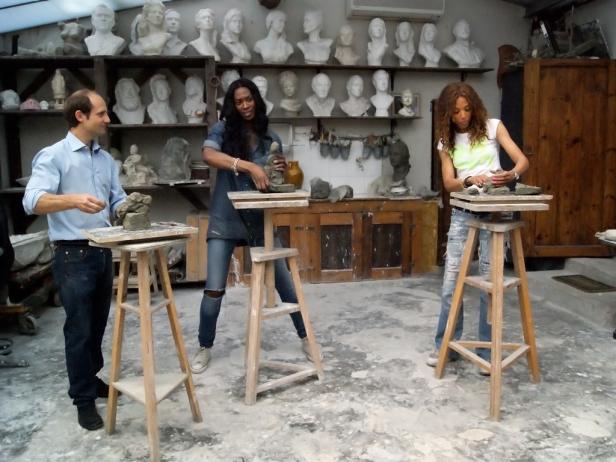
Where is `vase`? The image size is (616, 462). vase is located at coordinates (296, 174).